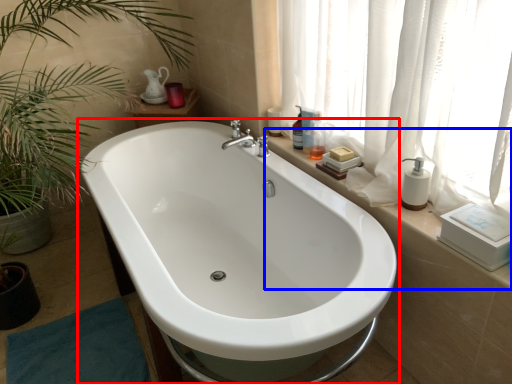
Question: Which point is further to the camera, bathtub (highlighted by a red box) or window sill (highlighted by a blue box)?

Choices:
 (A) bathtub
 (B) window sill

Answer: (B)